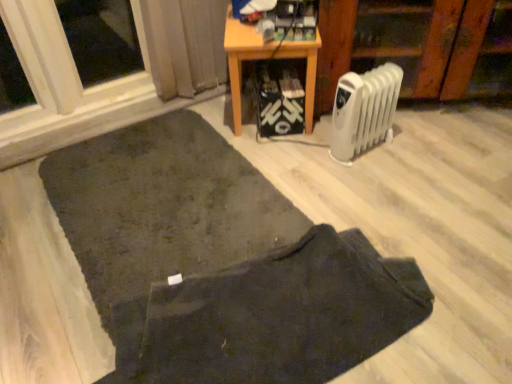
Question: Can you confirm if white plastic radiator at lower right is taller than dark fabric doormat at lower center?

Choices:
 (A) no
 (B) yes

Answer: (B)

Question: Is white plastic radiator at lower right positioned behind dark fabric doormat at lower center?

Choices:
 (A) yes
 (B) no

Answer: (A)

Question: Is white plastic radiator at lower right with dark fabric doormat at lower center?

Choices:
 (A) yes
 (B) no

Answer: (B)

Question: Considering the relative sizes of white plastic radiator at lower right and dark fabric doormat at lower center in the image provided, is white plastic radiator at lower right bigger than dark fabric doormat at lower center?

Choices:
 (A) yes
 (B) no

Answer: (B)

Question: From a real-world perspective, is white plastic radiator at lower right located higher than dark fabric doormat at lower center?

Choices:
 (A) no
 (B) yes

Answer: (B)

Question: Considering the positions of white plastic radiator at center-right and dark fabric doormat at lower center in the image, is white plastic radiator at center-right wider or thinner than dark fabric doormat at lower center?

Choices:
 (A) thin
 (B) wide

Answer: (B)

Question: Relative to dark fabric doormat at lower center, is white plastic radiator at center-right in front or behind?

Choices:
 (A) front
 (B) behind

Answer: (B)

Question: Does point (331, 28) appear closer or farther from the camera than point (406, 304)?

Choices:
 (A) closer
 (B) farther

Answer: (B)

Question: In terms of height, does white plastic radiator at center-right look taller or shorter compared to dark fabric doormat at lower center?

Choices:
 (A) tall
 (B) short

Answer: (A)

Question: In the image, is dark fabric doormat at lower center positioned in front of or behind wooden table at center?

Choices:
 (A) front
 (B) behind

Answer: (A)

Question: In the image, is dark fabric doormat at lower center on the left side or the right side of wooden table at center?

Choices:
 (A) right
 (B) left

Answer: (B)

Question: Is dark fabric doormat at lower center inside the boundaries of wooden table at center, or outside?

Choices:
 (A) inside
 (B) outside

Answer: (B)

Question: Looking at their shapes, would you say dark fabric doormat at lower center is wider or thinner than wooden table at center?

Choices:
 (A) thin
 (B) wide

Answer: (B)

Question: In terms of height, does dark fabric doormat at lower center look taller or shorter compared to white plastic radiator at lower right?

Choices:
 (A) tall
 (B) short

Answer: (B)

Question: From the image's perspective, relative to white plastic radiator at lower right, is dark fabric doormat at lower center above or below?

Choices:
 (A) above
 (B) below

Answer: (B)